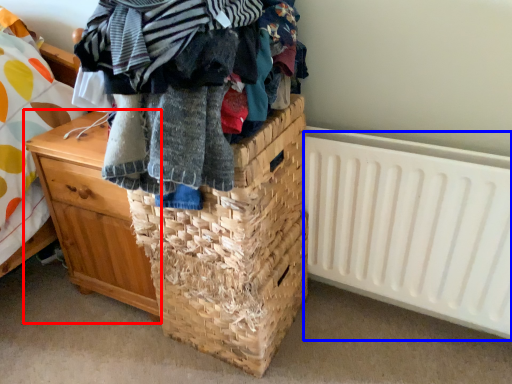
Question: Which object is further to the camera taking this photo, chest of drawers (highlighted by a red box) or radiator (highlighted by a blue box)?

Choices:
 (A) chest of drawers
 (B) radiator

Answer: (A)